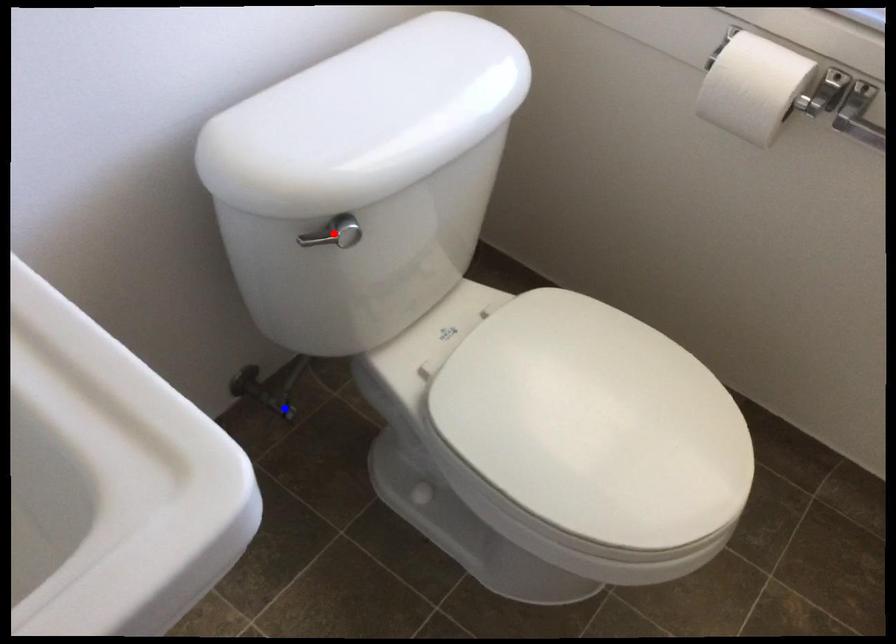
Question: In the image, two points are highlighted. Which point is nearer to the camera? Reply with the corresponding letter.

Choices:
 (A) blue point
 (B) red point

Answer: (B)